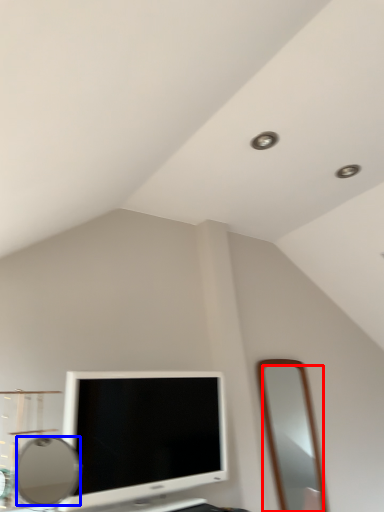
Question: Which object appears closest to the camera in this image, mirror (highlighted by a red box) or mirror (highlighted by a blue box)?

Choices:
 (A) mirror
 (B) mirror

Answer: (B)